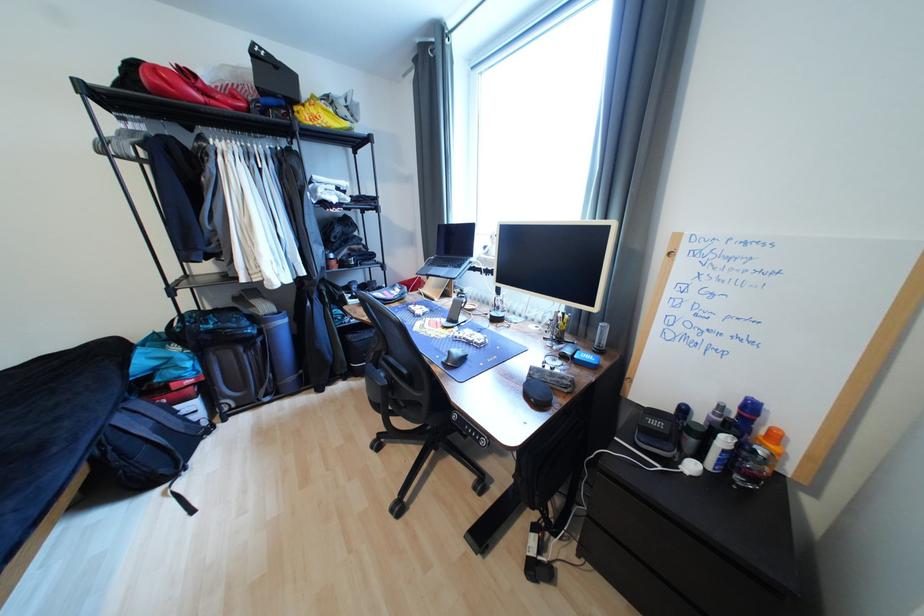
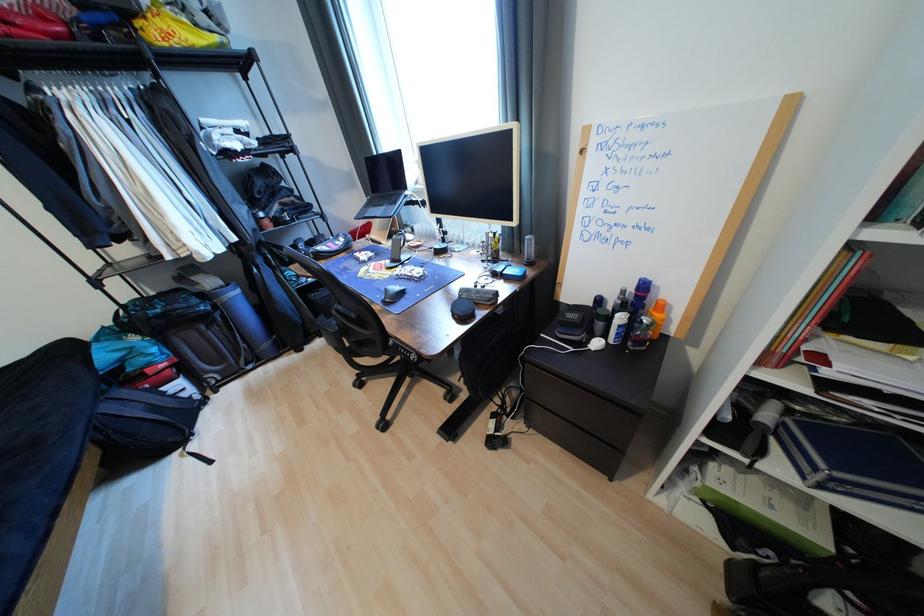
The point at (754,400) is marked in the first image. Where is the corresponding point in the second image?

(647, 282)